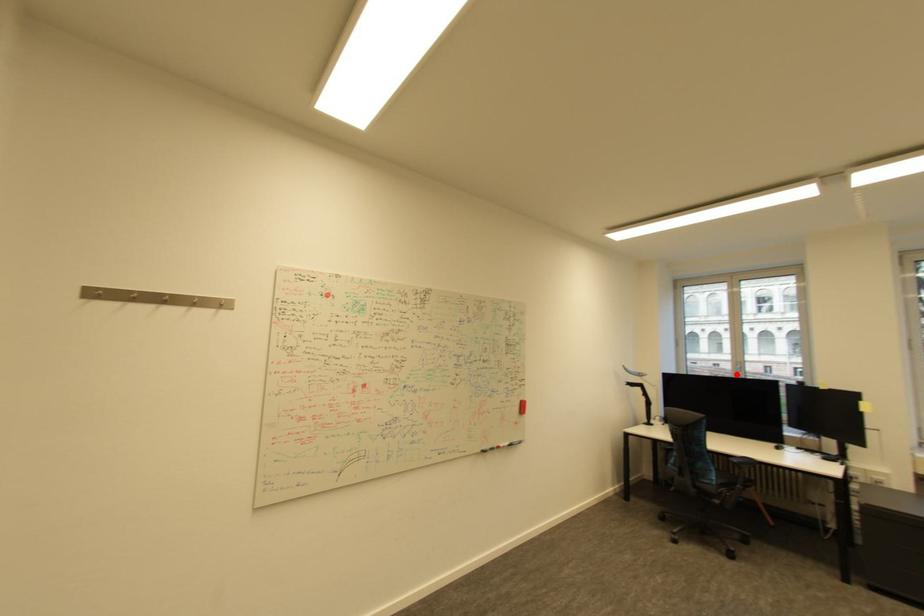
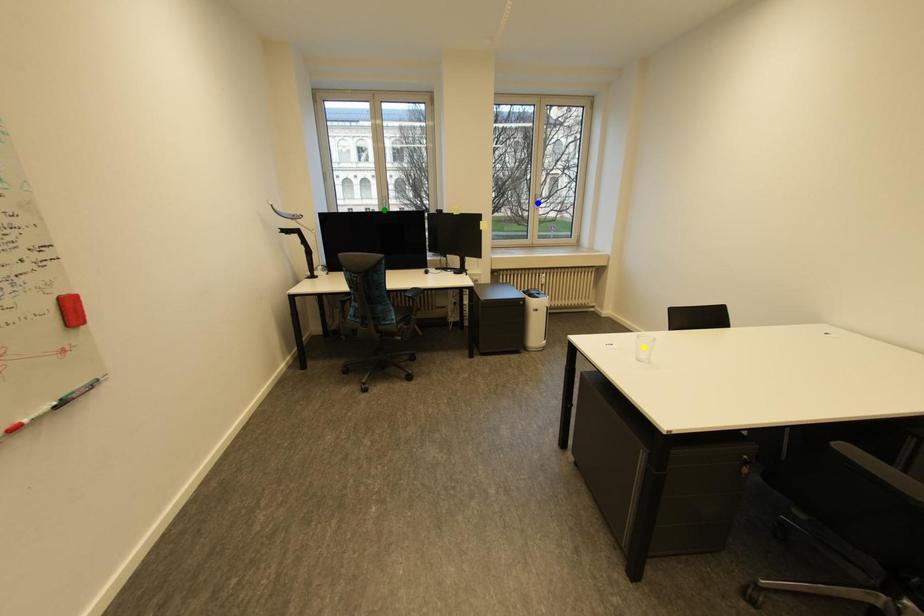
Question: I am providing you with two images of the same scene from different viewpoints. A red point is marked on the first image. You are given multiple points on the second image. Which point in image 2 is actually the same real-world point as the red point in image 1?

Choices:
 (A) green point
 (B) yellow point
 (C) blue point

Answer: (A)